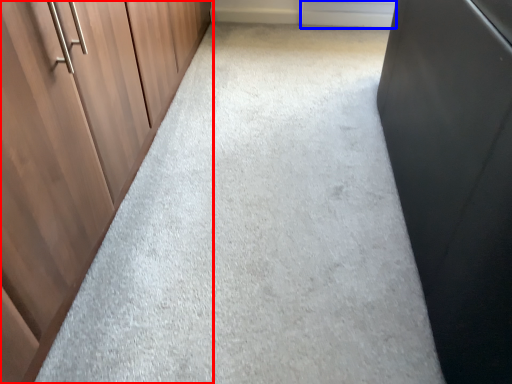
Question: Among these objects, which one is farthest to the camera, cupboard (highlighted by a red box) or window (highlighted by a blue box)?

Choices:
 (A) cupboard
 (B) window

Answer: (B)